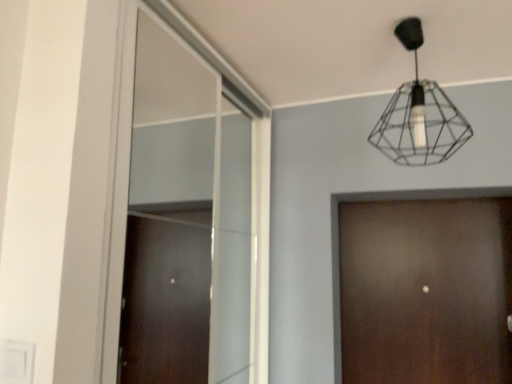
Question: Can you confirm if clear glass window at center is taller than wireframe black lamp at upper center?

Choices:
 (A) no
 (B) yes

Answer: (B)

Question: Are clear glass window at center and wireframe black lamp at upper center beside each other?

Choices:
 (A) yes
 (B) no

Answer: (B)

Question: Can you confirm if clear glass window at center is thinner than wireframe black lamp at upper center?

Choices:
 (A) yes
 (B) no

Answer: (A)

Question: Would you consider clear glass window at center to be distant from wireframe black lamp at upper center?

Choices:
 (A) no
 (B) yes

Answer: (A)

Question: Is wireframe black lamp at upper center a part of clear glass window at center?

Choices:
 (A) yes
 (B) no

Answer: (B)

Question: In terms of size, does clear glass window at center appear bigger or smaller than brown wood door at center?

Choices:
 (A) small
 (B) big

Answer: (B)

Question: From their relative heights in the image, would you say clear glass window at center is taller or shorter than brown wood door at center?

Choices:
 (A) short
 (B) tall

Answer: (B)

Question: Considering their positions, is clear glass window at center located in front of or behind brown wood door at center?

Choices:
 (A) behind
 (B) front

Answer: (B)

Question: From a real-world perspective, relative to brown wood door at center, is clear glass window at center vertically above or below?

Choices:
 (A) below
 (B) above

Answer: (B)

Question: In terms of width, does wireframe black lamp at upper center look wider or thinner when compared to clear glass window at center?

Choices:
 (A) thin
 (B) wide

Answer: (B)

Question: Visually, is wireframe black lamp at upper center positioned to the left or to the right of clear glass window at center?

Choices:
 (A) left
 (B) right

Answer: (B)

Question: Is point (372, 140) positioned closer to the camera than point (111, 288)?

Choices:
 (A) farther
 (B) closer

Answer: (A)

Question: From a real-world perspective, is wireframe black lamp at upper center physically located above or below clear glass window at center?

Choices:
 (A) below
 (B) above

Answer: (B)

Question: Is point (404, 117) closer or farther from the camera than point (454, 322)?

Choices:
 (A) farther
 (B) closer

Answer: (B)

Question: Is wireframe black lamp at upper center taller or shorter than brown wood door at center?

Choices:
 (A) short
 (B) tall

Answer: (A)